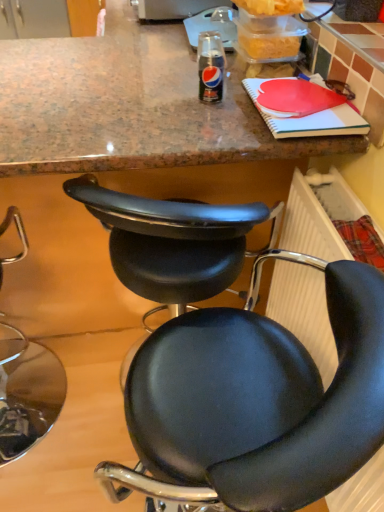
Question: Considering the positions of black leather chair at center, positioned as the third chair in left-to-right order, and black leather chair at lower left, arranged as the third chair when viewed from the right, in the image, is black leather chair at center, positioned as the third chair in left-to-right order, bigger or smaller than black leather chair at lower left, arranged as the third chair when viewed from the right,?

Choices:
 (A) small
 (B) big

Answer: (B)

Question: From a real-world perspective, is black leather chair at center, positioned as the third chair in left-to-right order, physically located above or below black leather chair at lower left, arranged as the third chair when viewed from the right?

Choices:
 (A) above
 (B) below

Answer: (A)

Question: Which object is the farthest from the plastic radiator at lower right?

Choices:
 (A) black leather chair at center, which ranks as the second chair in right-to-left order
 (B) black leather chair at lower left, acting as the 1th chair starting from the left
 (C) black leather chair at center, the first chair in the right-to-left sequence

Answer: (B)

Question: Considering the real-world distances, which object is farthest from the black leather chair at center, the first chair in the right-to-left sequence?

Choices:
 (A) plastic radiator at lower right
 (B) black leather chair at lower left, arranged as the third chair when viewed from the right
 (C) black leather chair at center, which ranks as the second chair in right-to-left order

Answer: (B)